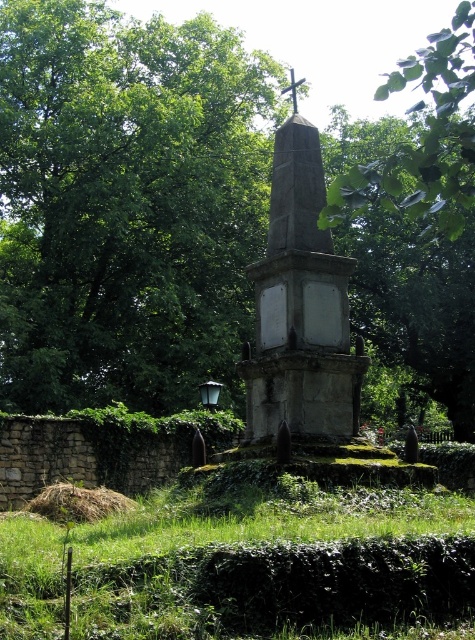
You are a gardener planning to plant a new flower bed between the green leafy tree at center and the green grass at lower center. Which area has more space available for planting?

The green leafy tree at center has a greater width than the green grass at lower center, so there is more space available for planting near the green leafy tree at center.

You are standing in front of the gray stone monument at center and want to take a photo of the green leafy tree at center. Which object is closer to you, and why?

The green leafy tree at center is closer to you because it is positioned further to the viewer than the gray stone monument at center, meaning it appears nearer in your line of sight.

You are standing at the base of the stone monument and want to walk towards the green leafy tree at center. Which direction should you head relative to the green grass at lower center?

You should head to the right side of the green grass at lower center because the green leafy tree at center is positioned on the right side of green grass at lower center.